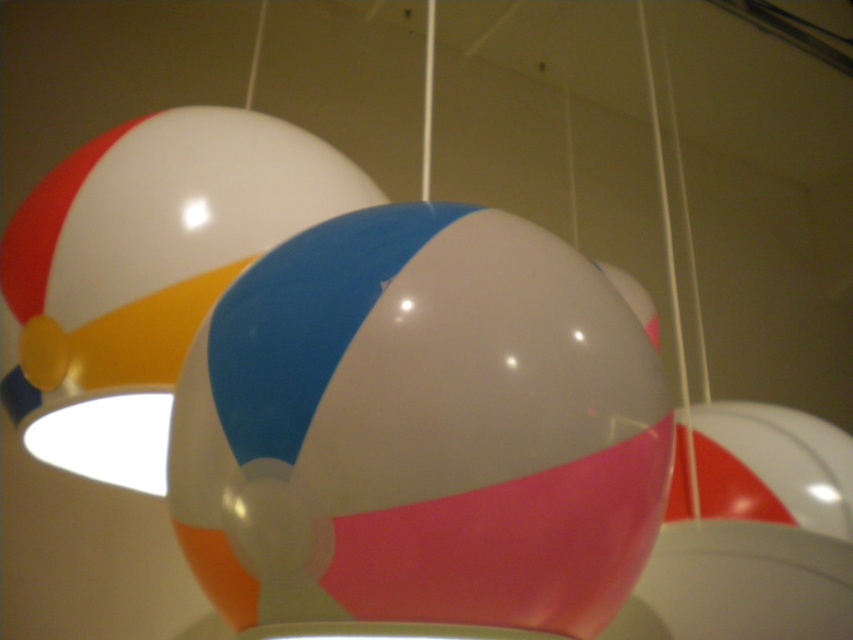
Question: Does glossy plastic ball at center appear under shiny plastic ball at center?

Choices:
 (A) no
 (B) yes

Answer: (B)

Question: Is glossy plastic ball at center bigger than shiny plastic ball at center?

Choices:
 (A) no
 (B) yes

Answer: (A)

Question: Is the position of glossy plastic ball at center more distant than that of shiny plastic ball at center?

Choices:
 (A) no
 (B) yes

Answer: (A)

Question: Which point is farther to the camera?

Choices:
 (A) coord(653,424)
 (B) coord(77,196)

Answer: (B)

Question: Which point is closer to the camera taking this photo?

Choices:
 (A) (323, 310)
 (B) (151, 241)

Answer: (A)

Question: Which of the following is the farthest from the observer?

Choices:
 (A) (556, 307)
 (B) (38, 241)

Answer: (B)